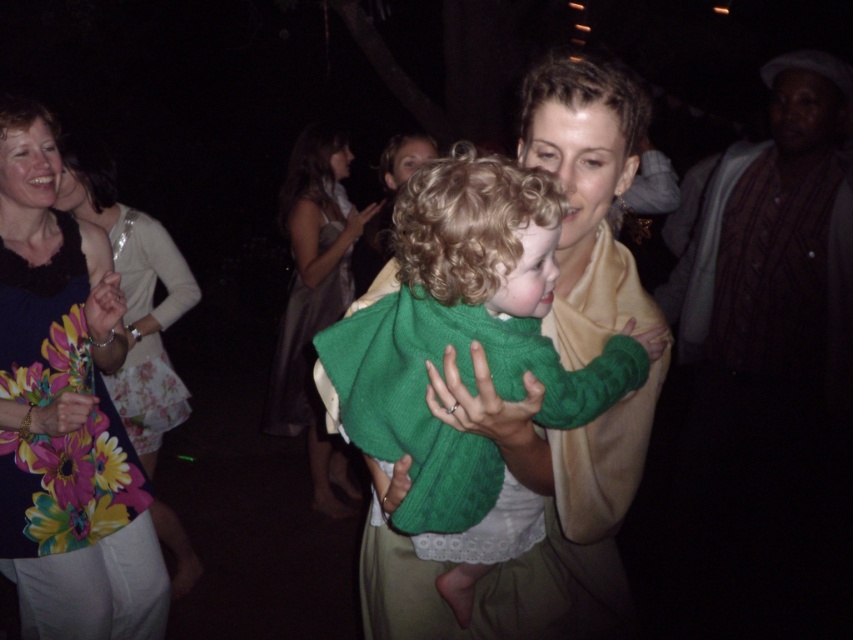
You are at a party and see two dresses in the image. The floral dress at left and the silky beige dress at center. Which dress is positioned lower in the image?

The floral dress at left is located below the silky beige dress at center, so the floral dress at left is positioned lower in the image.

In the nighttime gathering scene, you see a child wearing a green knitted sweater at center and a woman wearing a silky beige dress at center. Which clothing item is smaller?

The green knitted sweater at center is smaller than the silky beige dress at center.

You are a photographer at the event and want to capture both the green knitted sweater at center and the floral dress at left in a single frame. Which object should you zoom out to include more of?

The green knitted sweater at center is wider than the floral dress at left, so you should zoom out to include more of the green knitted sweater at center.